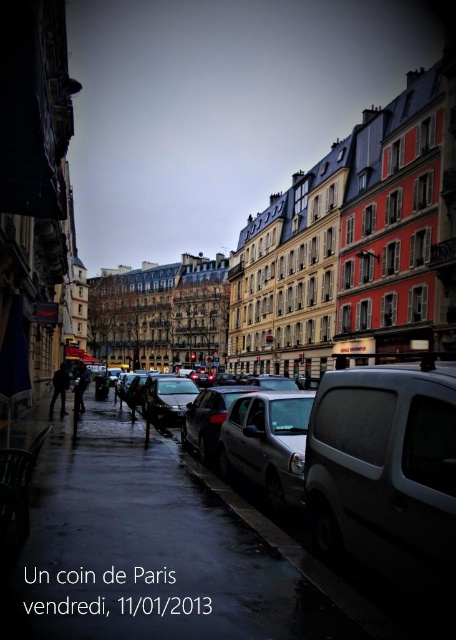
Question: Considering the relative positions of satin black car at center and dark gray jacket at left in the image provided, where is satin black car at center located with respect to dark gray jacket at left?

Choices:
 (A) right
 (B) left

Answer: (A)

Question: Which of the following is the closest to the observer?

Choices:
 (A) (200, 422)
 (B) (77, 394)
 (C) (41, 566)

Answer: (C)

Question: Does shiny silver car at center appear on the right side of dark gray jacket at center?

Choices:
 (A) no
 (B) yes

Answer: (B)

Question: Which object is the closest to the dark gray jacket at center?

Choices:
 (A) dark gray jacket at left
 (B) wet asphalt sidewalk at lower left

Answer: (A)

Question: Which point is closer to the camera?

Choices:
 (A) (77, 374)
 (B) (60, 381)
 (C) (195, 428)
 (D) (223, 472)

Answer: (D)

Question: Is wet asphalt sidewalk at lower left thinner than shiny silver car at center?

Choices:
 (A) no
 (B) yes

Answer: (A)